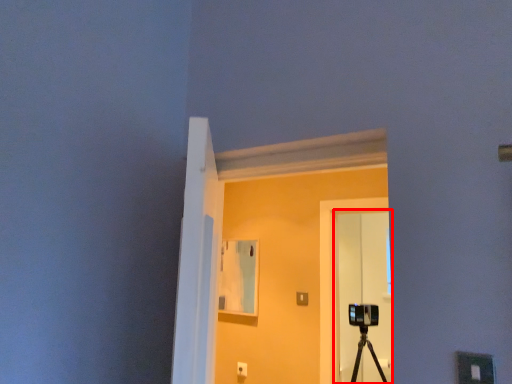
Question: From the image's perspective, where is glass door (annotated by the red box) located relative to window?

Choices:
 (A) above
 (B) below

Answer: (B)